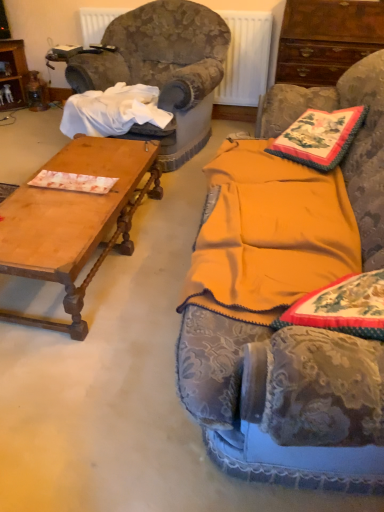
Locate an element on the screen. This screenshot has width=384, height=512. vacant region above wooden polished coffee table at left (from a real-world perspective) is located at coordinates (75, 192).